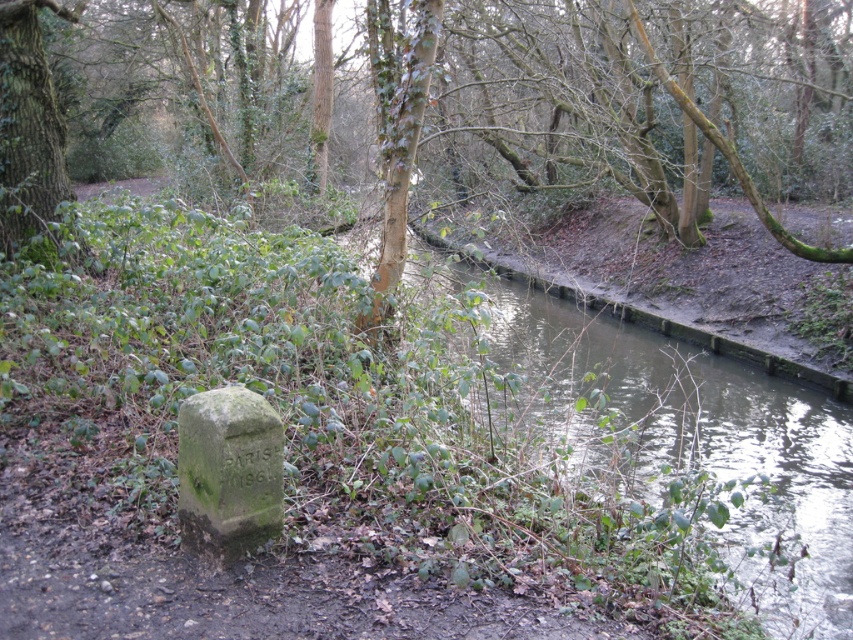
Is green mossy bank at center taller than green rough bark tree at upper left?

Indeed, green mossy bank at center has a greater height compared to green rough bark tree at upper left.

Based on the photo, between green mossy bank at center and green rough bark tree at upper left, which one has more height?

With more height is green mossy bank at center.

Which is in front, point (799, 602) or point (16, 200)?

Point (799, 602) is in front.

Find the location of a particular element. The image size is (853, 640). green mossy bank at center is located at coordinates (701, 429).

Can you confirm if green mossy bank at center is shorter than green mossy stone at lower left?

No.

Can you confirm if green mossy bank at center is positioned to the right of green mossy stone at lower left?

Yes, green mossy bank at center is to the right of green mossy stone at lower left.

The width and height of the screenshot is (853, 640). Describe the element at coordinates (701, 429) in the screenshot. I see `green mossy bank at center` at that location.

Image resolution: width=853 pixels, height=640 pixels. In order to click on green mossy bank at center in this screenshot , I will do `click(701, 429)`.

Can you confirm if green mossy stone at lower left is thinner than green rough bark tree at upper left?

Yes.

What do you see at coordinates (229, 472) in the screenshot?
I see `green mossy stone at lower left` at bounding box center [229, 472].

Is point (267, 420) closer to viewer compared to point (16, 227)?

Yes, point (267, 420) is in front of point (16, 227).

At what (x,y) coordinates should I click in order to perform the action: click on green mossy stone at lower left. Please return your answer as a coordinate pair (x, y). Looking at the image, I should click on (229, 472).